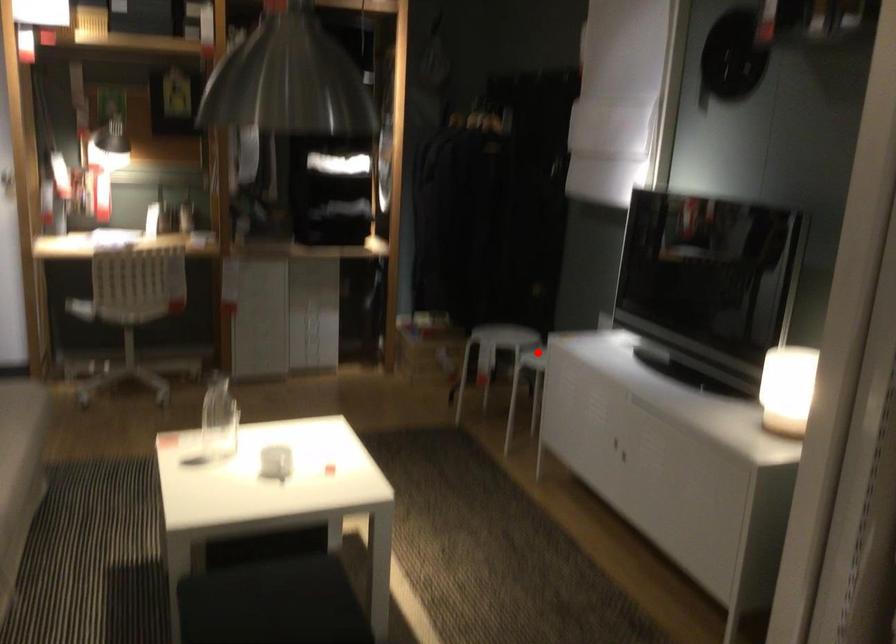
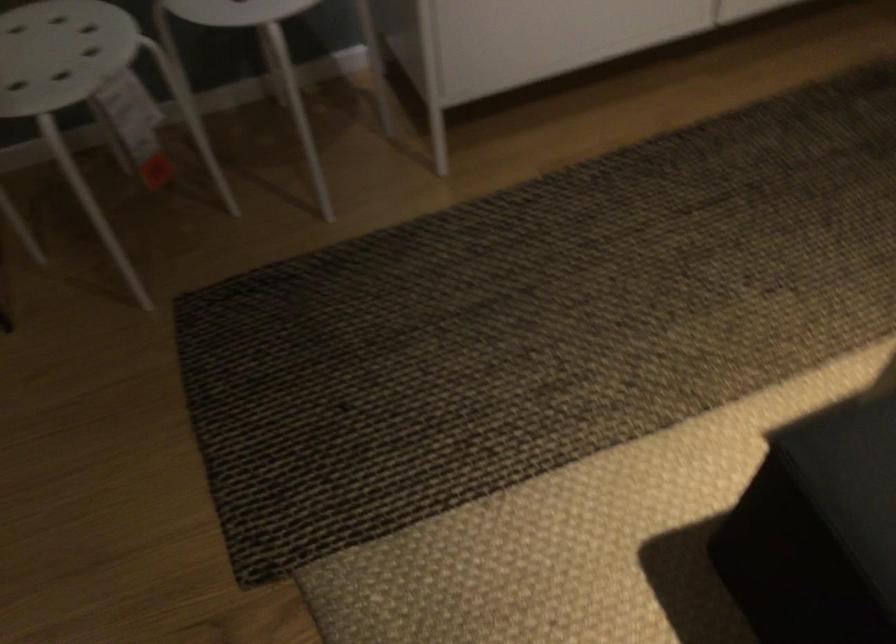
Question: A red point is marked in image1. In image2, is the corresponding 3D point closer to the camera or farther? Reply with the corresponding letter.

Choices:
 (A) The corresponding 3D point is closer.
 (B) The corresponding 3D point is farther.

Answer: (A)